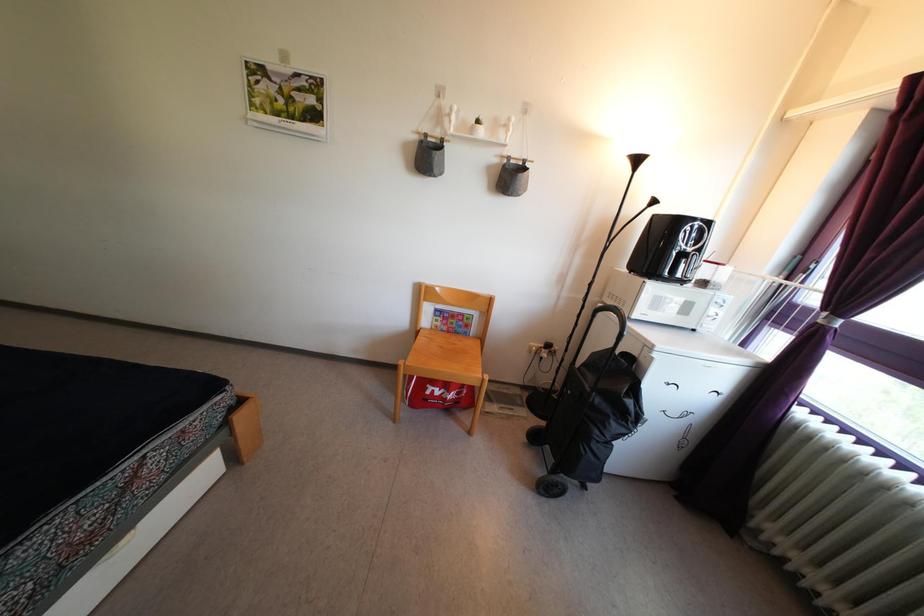
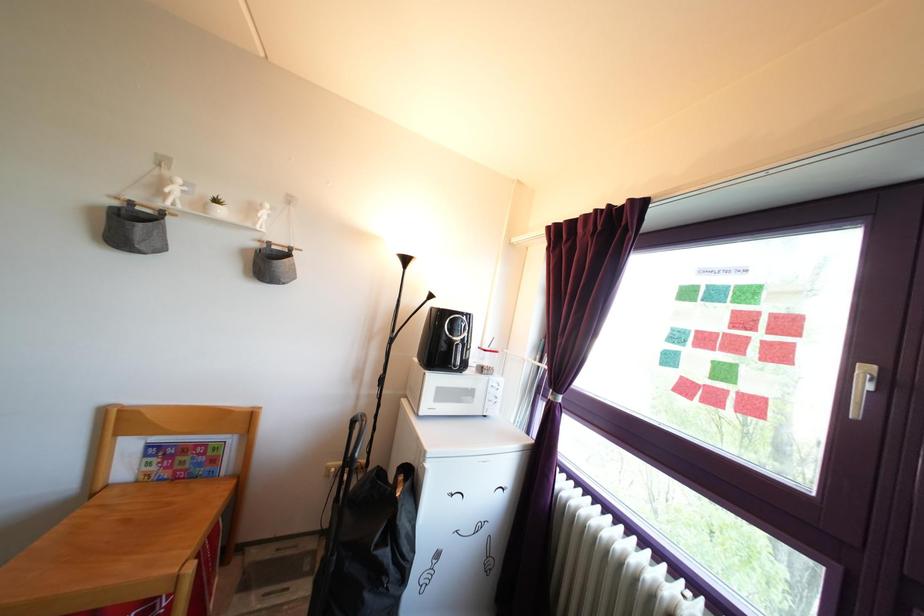
The point at (419, 146) is marked in the first image. Where is the corresponding point in the second image?

(118, 211)